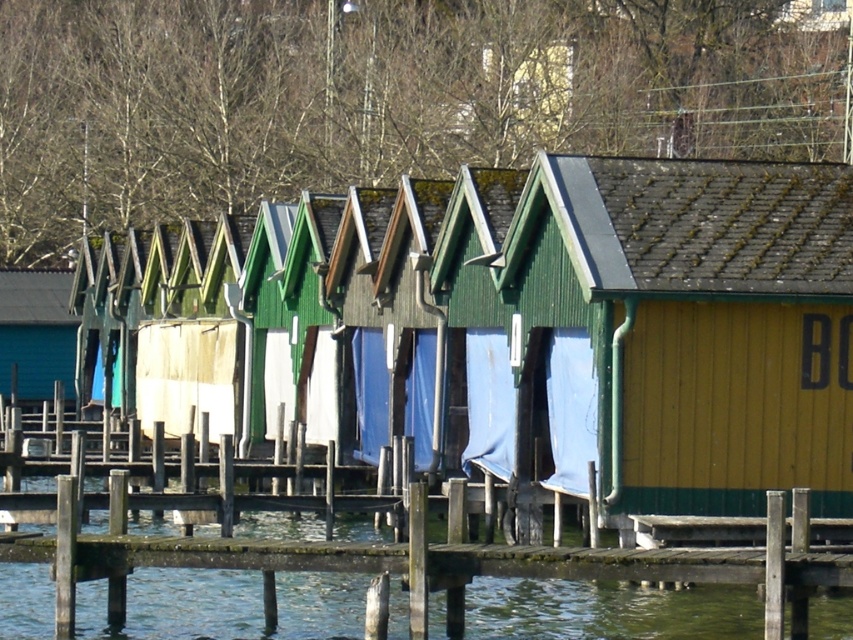
Question: Can you confirm if yellow wood cabin at right is positioned below blue fabric at center?

Choices:
 (A) no
 (B) yes

Answer: (A)

Question: In this image, where is yellow wood cabin at right located relative to blue fabric at center?

Choices:
 (A) below
 (B) above

Answer: (B)

Question: Does yellow wood cabin at right appear under blue fabric at center?

Choices:
 (A) no
 (B) yes

Answer: (A)

Question: Which object is closer to the camera taking this photo?

Choices:
 (A) yellow wood cabin at right
 (B) blue fabric at center

Answer: (A)

Question: Which of the following is the closest to the observer?

Choices:
 (A) (811, 355)
 (B) (579, 372)

Answer: (A)

Question: Which of the following is the farthest from the observer?

Choices:
 (A) blue fabric at center
 (B) yellow wood cabin at right

Answer: (A)